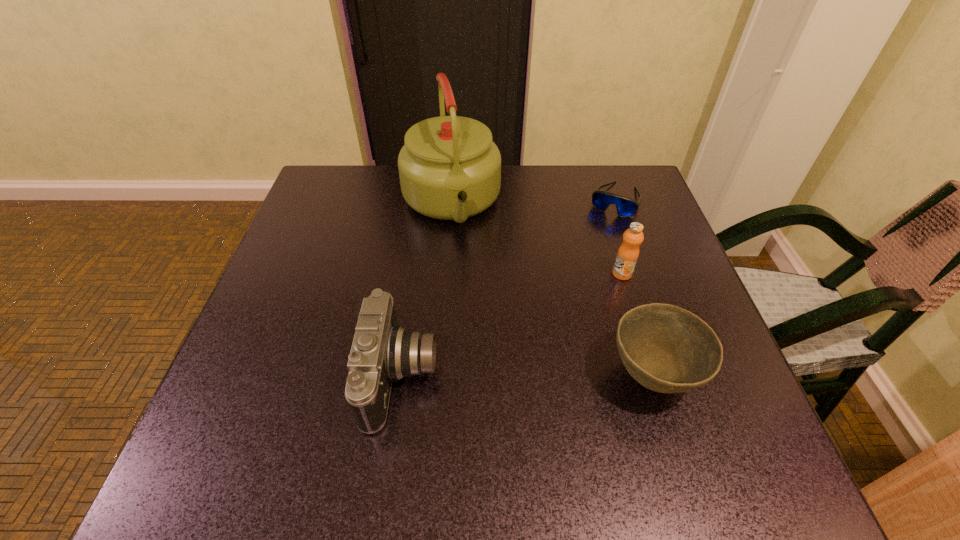
Locate an element on the screen. Image resolution: width=960 pixels, height=540 pixels. bowl at the right edge is located at coordinates (667, 349).

Locate an element on the screen. The width and height of the screenshot is (960, 540). sunglasses situated at the right edge is located at coordinates (626, 207).

Identify the location of orange juice positioned at the right edge. (627, 256).

The height and width of the screenshot is (540, 960). What are the coordinates of `object at the far right corner` in the screenshot? It's located at click(x=626, y=207).

You are a GUI agent. You are given a task and a screenshot of the screen. Output one action in this format:
    pyautogui.click(x=<x>, y=<y>)
    Task: Click on the object that is at the near right corner
    
    Given the screenshot: What is the action you would take?
    pyautogui.click(x=667, y=349)

Where is `vacant region at the far edge`? vacant region at the far edge is located at coordinates (375, 195).

Identify the location of vacant space at the near edge of the desktop. This screenshot has height=540, width=960. (457, 413).

In order to click on vacant space at the left edge of the desktop in this screenshot , I will do `click(324, 229)`.

Locate an element on the screen. vacant region at the right edge of the desktop is located at coordinates (604, 220).

The height and width of the screenshot is (540, 960). In the image, there is a desktop. In order to click on blank space at the far left corner in this screenshot , I will do `click(330, 191)`.